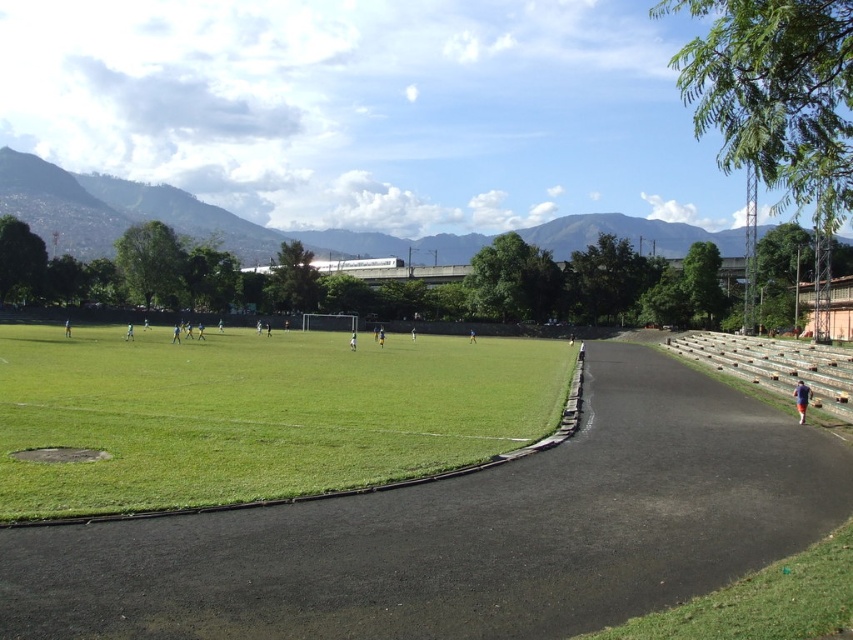
You are a soccer player standing on the green grass at lower right and want to reach the green grass at center. Which direction should you move to get there?

The green grass at center is wider than the green grass at lower right, so you should move towards the center of the field to reach it.

From the picture: You are standing at the center of the soccer field and want to walk to the green grass at lower right. Which direction should you walk?

You should walk towards the lower right direction to reach the green grass at lower right.